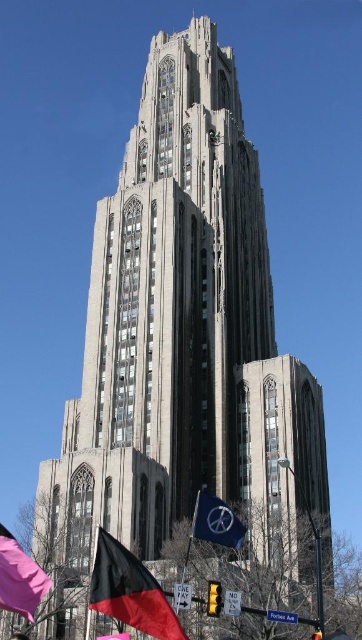
Question: Can you confirm if black fabric flag at lower left is positioned to the right of blue fabric flag at lower center?

Choices:
 (A) no
 (B) yes

Answer: (A)

Question: Among these objects, which one is farthest from the camera?

Choices:
 (A) black fabric flag at lower left
 (B) matte pink flag at lower left
 (C) blue fabric flag at lower center

Answer: (C)

Question: Is matte pink flag at lower left behind blue fabric flag at lower center?

Choices:
 (A) yes
 (B) no

Answer: (B)

Question: Which object is positioned farthest from the blue fabric flag at lower center?

Choices:
 (A) black fabric flag at lower left
 (B) matte pink flag at lower left

Answer: (B)

Question: Does black fabric flag at lower left have a smaller size compared to blue fabric flag at lower center?

Choices:
 (A) yes
 (B) no

Answer: (B)

Question: Among these objects, which one is nearest to the camera?

Choices:
 (A) black fabric flag at lower left
 (B) matte pink flag at lower left

Answer: (A)